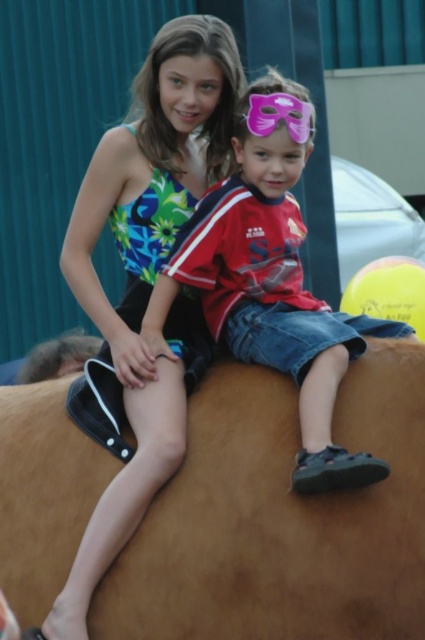
Question: Estimate the real-world distances between objects in this image. Which object is closer to the matte red shirt at center?

Choices:
 (A) multicolored fabric dress at upper left
 (B) brown leather horse at center

Answer: (A)

Question: Which object is positioned farthest from the multicolored fabric dress at upper left?

Choices:
 (A) brown leather horse at center
 (B) matte red shirt at center

Answer: (A)

Question: From the image, what is the correct spatial relationship of brown leather horse at center in relation to matte red shirt at center?

Choices:
 (A) below
 (B) above

Answer: (A)

Question: Is brown leather horse at center smaller than multicolored fabric dress at upper left?

Choices:
 (A) yes
 (B) no

Answer: (A)

Question: Which point appears farthest from the camera in this image?

Choices:
 (A) (5, 388)
 (B) (141, 474)

Answer: (A)

Question: Does brown leather horse at center have a larger size compared to multicolored fabric dress at upper left?

Choices:
 (A) no
 (B) yes

Answer: (A)